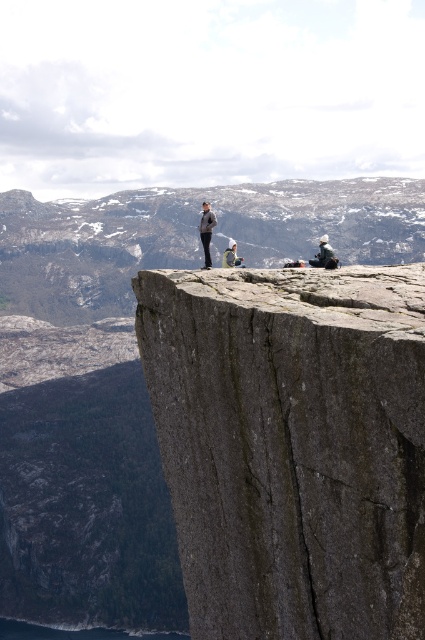
Does gray fabric jacket at center have a greater width compared to light gray fabric jacket at center?

In fact, gray fabric jacket at center might be narrower than light gray fabric jacket at center.

Find the location of a particular element. This screenshot has width=425, height=640. gray fabric jacket at center is located at coordinates (206, 230).

The width and height of the screenshot is (425, 640). I want to click on gray fabric jacket at center, so click(206, 230).

Can you confirm if gray rough rock at center is positioned to the right of gray fabric jacket at center?

Incorrect, gray rough rock at center is not on the right side of gray fabric jacket at center.

Can you confirm if gray rough rock at center is positioned below gray fabric jacket at center?

No, gray rough rock at center is not below gray fabric jacket at center.

I want to click on gray rough rock at center, so click(190, 236).

Does gray rough rock face at center have a greater width compared to light gray fabric jacket at center?

Indeed, gray rough rock face at center has a greater width compared to light gray fabric jacket at center.

Does point (348, 426) come closer to viewer compared to point (226, 257)?

Yes, point (348, 426) is in front of point (226, 257).

Find the location of a particular element. gray rough rock face at center is located at coordinates (291, 445).